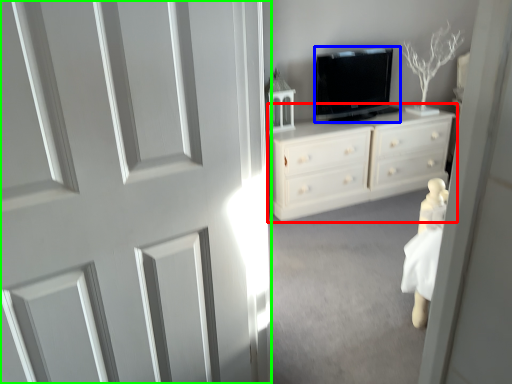
Question: Which object is the farthest from chest of drawers (highlighted by a red box)? Choose among these: television (highlighted by a blue box) or door (highlighted by a green box).

Choices:
 (A) television
 (B) door

Answer: (B)